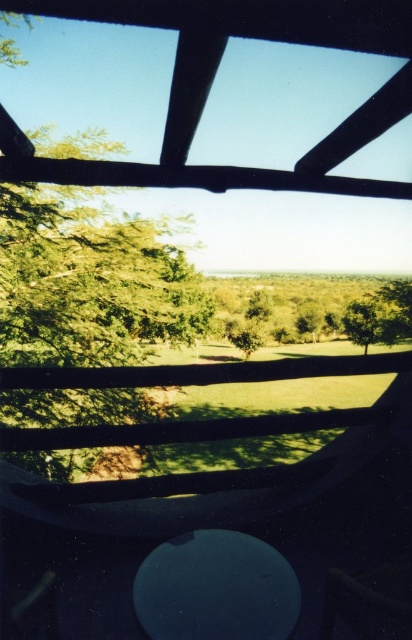
Which of these two, green leafy tree at center or green leafy tree at lower right, stands taller?

Standing taller between the two is green leafy tree at lower right.

Is green leafy tree at center further to camera compared to green leafy tree at lower right?

Yes, green leafy tree at center is behind green leafy tree at lower right.

Is point (372, 298) behind point (407, 284)?

No, it is not.

Locate an element on the screen. green leafy tree at center is located at coordinates (367, 321).

Is green leafy tree at left above green leafy tree at center?

Correct, green leafy tree at left is located above green leafy tree at center.

Which of these two, green leafy tree at left or green leafy tree at center, stands taller?

Standing taller between the two is green leafy tree at left.

The image size is (412, 640). Find the location of `green leafy tree at left`. green leafy tree at left is located at coordinates (89, 282).

Identify the location of green leafy tree at left. This screenshot has width=412, height=640. (89, 282).

Is green leafy tree at left positioned in front of green leafy tree at lower right?

Yes.

Locate an element on the screen. Image resolution: width=412 pixels, height=640 pixels. green leafy tree at left is located at coordinates (89, 282).

You are a GUI agent. You are given a task and a screenshot of the screen. Output one action in this format:
    pyautogui.click(x=<x>, y=<y>)
    Task: Click on the green leafy tree at left
    
    Given the screenshot: What is the action you would take?
    pyautogui.click(x=89, y=282)